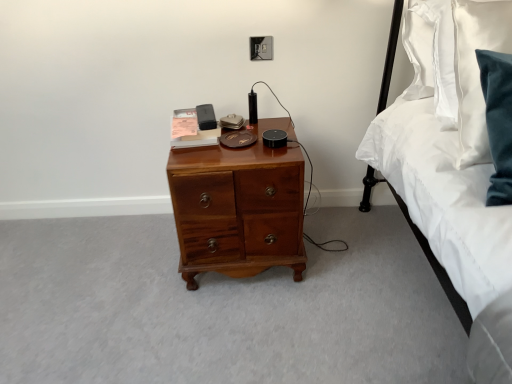
Identify the location of vacant region in front of shiny brown wooden chest of drawers at center. [238, 328].